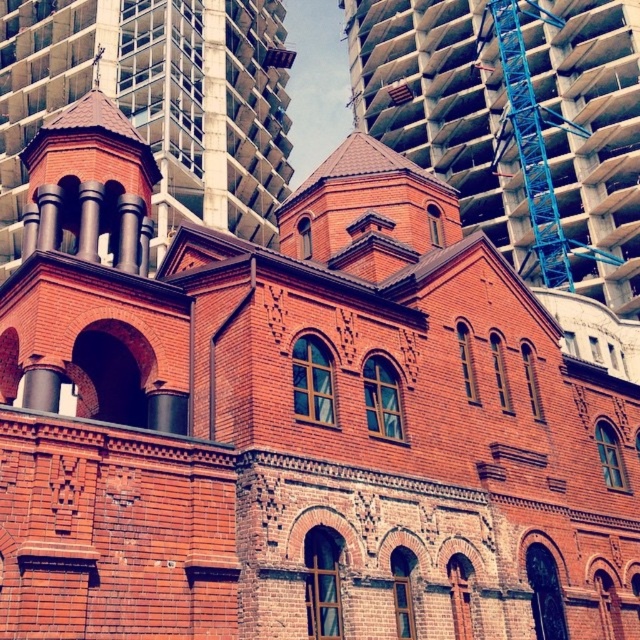
Question: Which point is closer to the camera?

Choices:
 (A) blue metallic crane at upper right
 (B) red brick tower at upper left

Answer: (B)

Question: Does red brick tower at upper left have a lesser width compared to blue metallic crane at upper right?

Choices:
 (A) no
 (B) yes

Answer: (A)

Question: Which of the following is the farthest from the observer?

Choices:
 (A) (593, 134)
 (B) (248, 163)

Answer: (B)

Question: Can you confirm if red brick tower at upper left is positioned to the left of blue metallic crane at upper right?

Choices:
 (A) yes
 (B) no

Answer: (A)

Question: Is red brick building at center above blue metallic crane at upper right?

Choices:
 (A) no
 (B) yes

Answer: (B)

Question: Which of the following is the farthest from the observer?

Choices:
 (A) (172, 52)
 (B) (513, 45)
 (C) (612, 80)

Answer: (B)